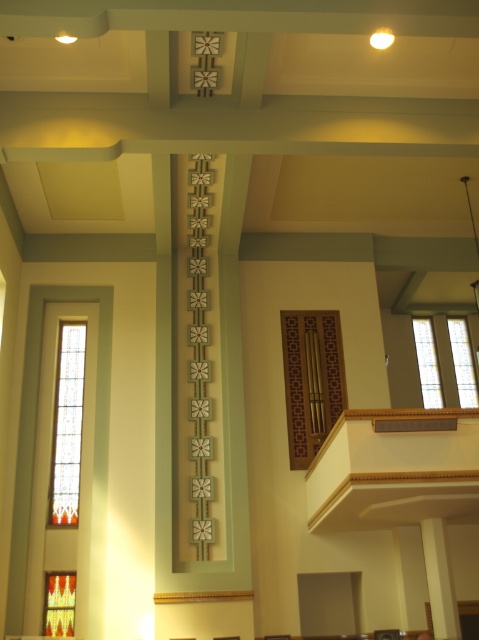
Which of these two, stained glass window at left or stained glass at upper right, stands taller?

Standing taller between the two is stained glass window at left.

Locate an element on the screen. This screenshot has height=640, width=479. stained glass window at left is located at coordinates (68, 426).

Looking at this image, measure the distance from stained glass window at left to clear glass window at upper right.

They are 7.67 meters apart.

Is stained glass window at left smaller than clear glass window at upper right?

No.

The image size is (479, 640). Describe the element at coordinates (68, 426) in the screenshot. I see `stained glass window at left` at that location.

I want to click on stained glass window at left, so click(x=68, y=426).

Does clear glass window at upper right appear on the left side of stained glass window at right?

Yes, clear glass window at upper right is to the left of stained glass window at right.

The image size is (479, 640). What are the coordinates of `clear glass window at upper right` in the screenshot? It's located at (426, 362).